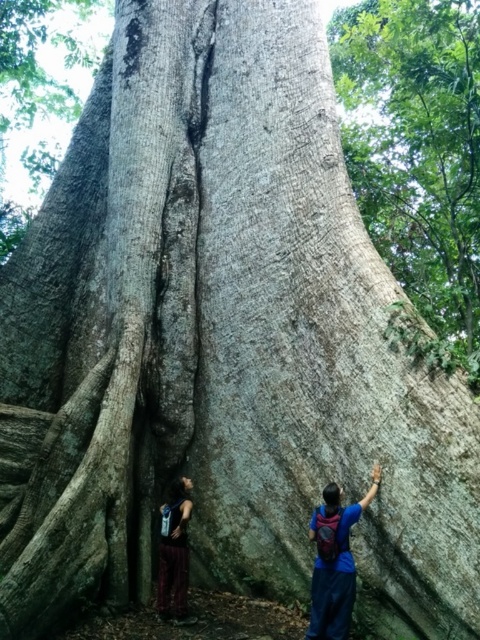
Question: Can you confirm if rough bark tree at upper right is positioned to the right of dark brown leather pants at lower left?

Choices:
 (A) yes
 (B) no

Answer: (A)

Question: Which of the following is the closest to the observer?

Choices:
 (A) [328, 500]
 (B) [463, 349]
 (C) [162, 508]

Answer: (A)

Question: Does blue fabric backpack at right have a larger size compared to dark brown leather pants at lower left?

Choices:
 (A) yes
 (B) no

Answer: (A)

Question: Among these points, which one is nearest to the camera?

Choices:
 (A) (445, 314)
 (B) (160, 560)
 (C) (365, 500)

Answer: (C)

Question: Which object is positioned closest to the dark brown leather pants at lower left?

Choices:
 (A) blue fabric backpack at right
 (B) rough bark tree at upper right

Answer: (A)

Question: Is the position of blue fabric backpack at right less distant than that of dark brown leather pants at lower left?

Choices:
 (A) no
 (B) yes

Answer: (B)